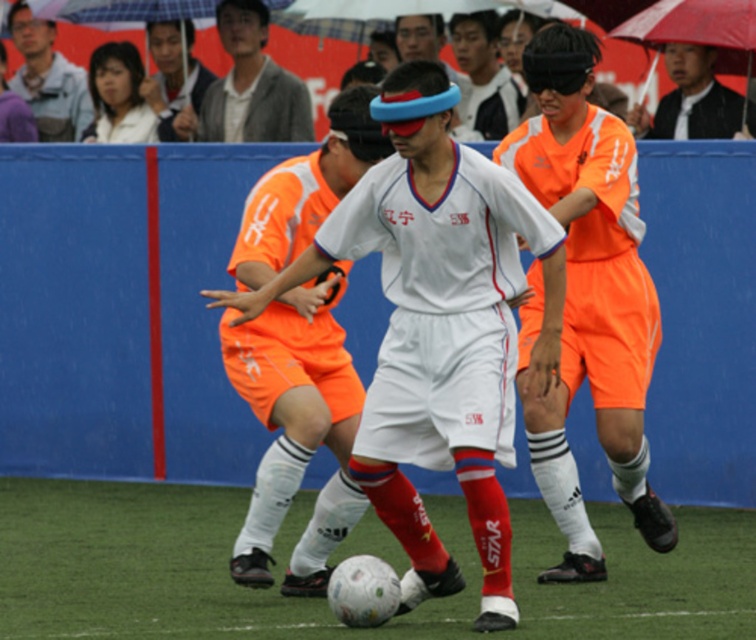
Between white matte soccer ball at center and matte orange shorts at center, which one appears on the right side from the viewer's perspective?

white matte soccer ball at center

Can you confirm if white matte soccer ball at center is positioned below matte orange shorts at center?

Correct, white matte soccer ball at center is located below matte orange shorts at center.

Where is `white matte soccer ball at center`? The image size is (756, 640). white matte soccer ball at center is located at coordinates (438, 328).

Between green grass at center and orange jersey at center, which one is positioned higher?

orange jersey at center

Does green grass at center come behind orange jersey at center?

No, green grass at center is in front of orange jersey at center.

Does point (742, 627) come behind point (751, 102)?

No, (742, 627) is closer to viewer.

Image resolution: width=756 pixels, height=640 pixels. Find the location of `green grass at center`. green grass at center is located at coordinates (172, 566).

Does orange jersey at center appear on the right side of matte gray shirt at upper left?

Indeed, orange jersey at center is positioned on the right side of matte gray shirt at upper left.

Does orange jersey at center appear under matte gray shirt at upper left?

Indeed, orange jersey at center is positioned under matte gray shirt at upper left.

What are the coordinates of `orange jersey at center` in the screenshot? It's located at (693, 100).